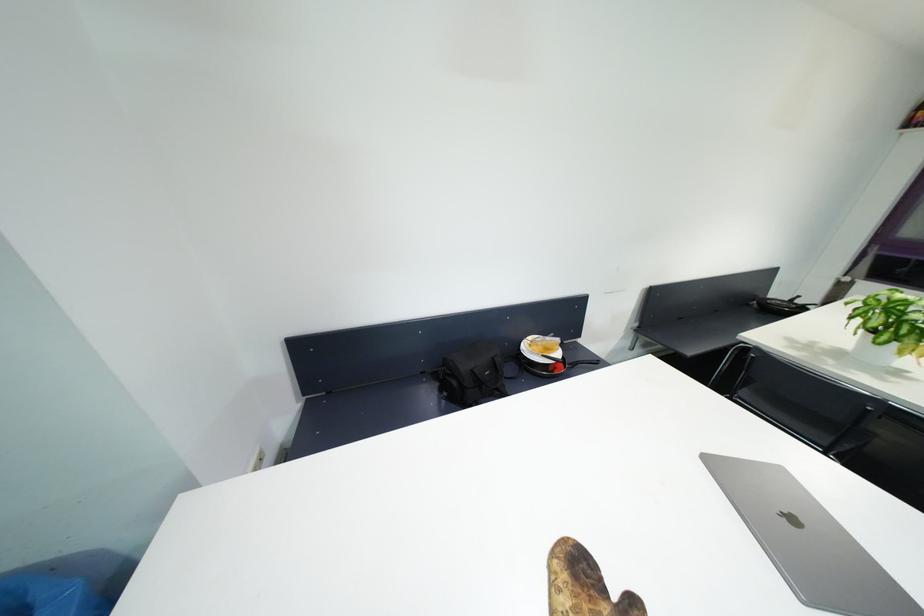
The width and height of the screenshot is (924, 616). What do you see at coordinates (489, 373) in the screenshot? I see `the black bag handle` at bounding box center [489, 373].